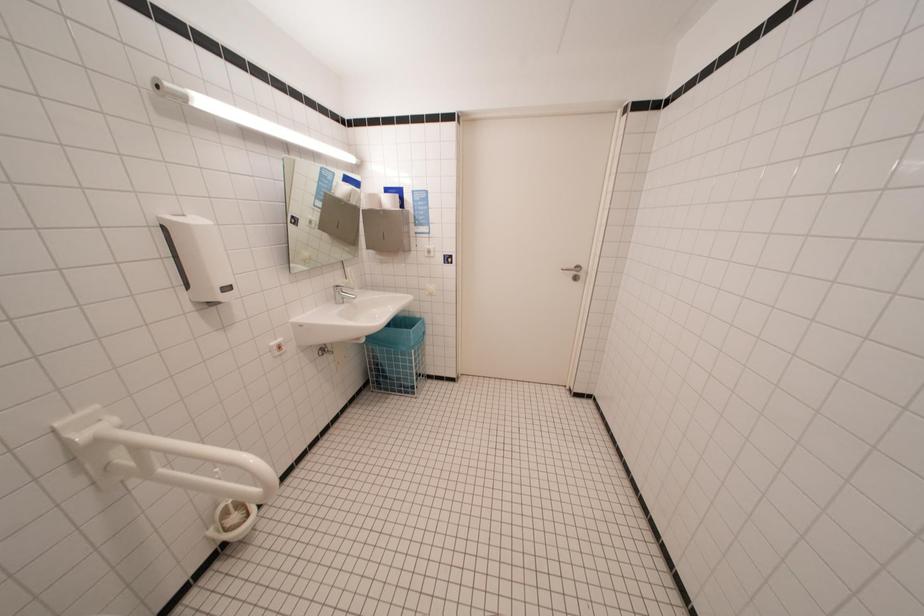
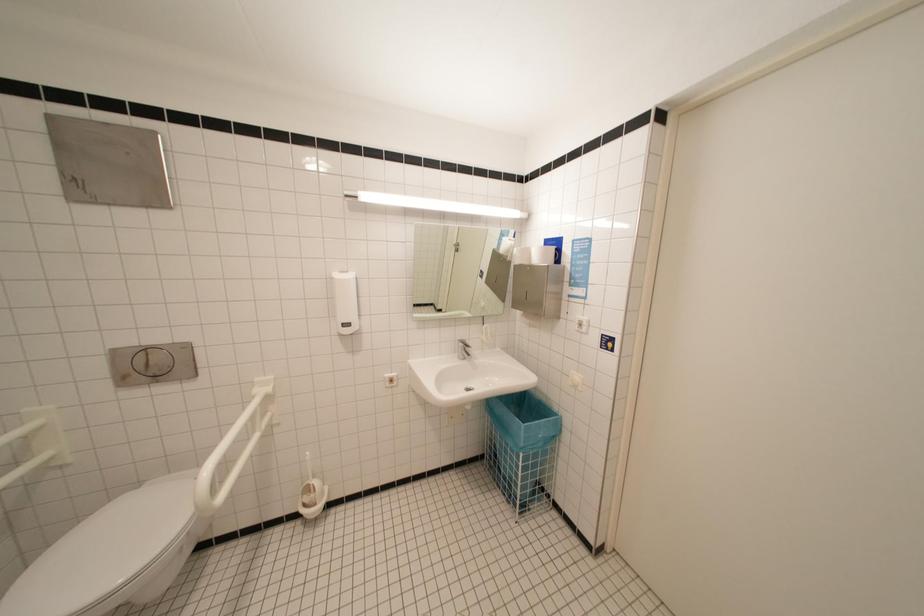
Question: The camera is either moving clockwise (left) or counter-clockwise (right) around the object. The first image is from the beginning of the video and the second image is from the end. Is the camera moving left or right when shooting the video?

Choices:
 (A) Left
 (B) Right

Answer: (B)